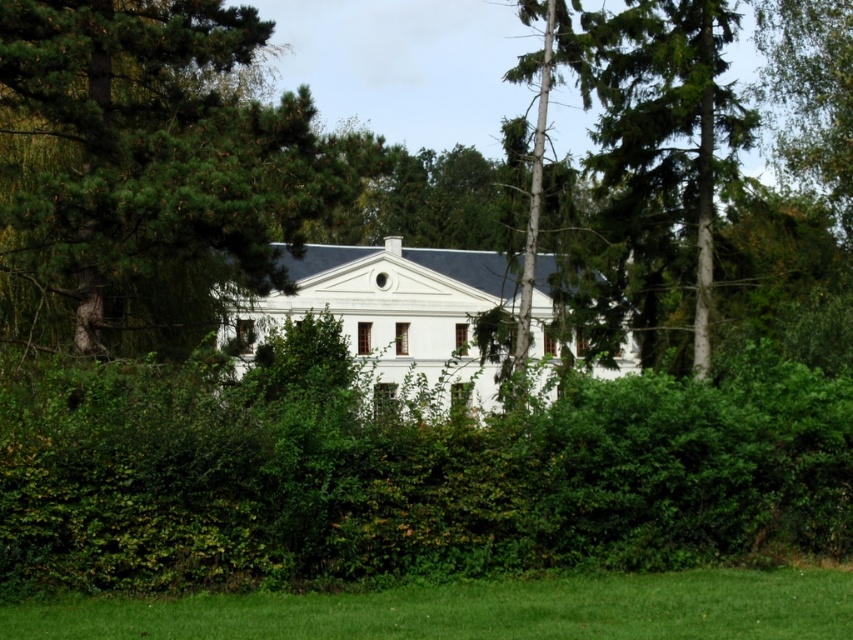
Can you confirm if green pine tree at center is positioned below smooth bark tree at center?

Incorrect, green pine tree at center is not positioned below smooth bark tree at center.

Is green pine tree at center shorter than smooth bark tree at center?

Incorrect, green pine tree at center's height does not fall short of smooth bark tree at center's.

Between point (171, 118) and point (517, 316), which one is positioned behind?

The point (517, 316) is more distant.

Locate an element on the screen. green pine tree at center is located at coordinates (149, 168).

Between green leafy tree at upper right and smooth bark tree at center, which one has more height?

With more height is green leafy tree at upper right.

Does green leafy tree at upper right appear on the left side of smooth bark tree at center?

Incorrect, green leafy tree at upper right is not on the left side of smooth bark tree at center.

Identify the location of green leafy tree at upper right. (666, 129).

The width and height of the screenshot is (853, 640). Find the location of `green leafy tree at upper right`. green leafy tree at upper right is located at coordinates (666, 129).

Who is more forward, (18, 230) or (598, 22)?

Point (18, 230)

Measure the distance between point (352, 195) and camera.

The distance of point (352, 195) from camera is 19.58 meters.

Find the location of a particular element. Image resolution: width=853 pixels, height=640 pixels. green pine tree at center is located at coordinates tap(149, 168).